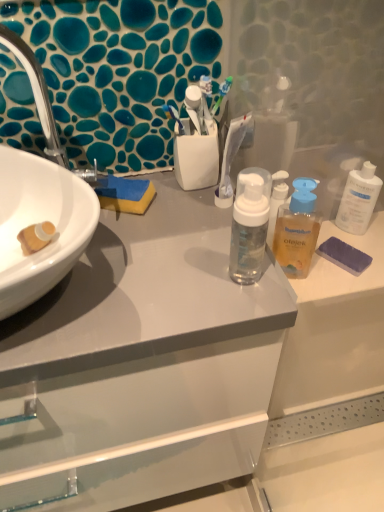
Question: Is purple sponge at right not within white glossy cabinet at center?

Choices:
 (A) no
 (B) yes

Answer: (B)

Question: Is purple sponge at right far from white glossy cabinet at center?

Choices:
 (A) yes
 (B) no

Answer: (B)

Question: From a real-world perspective, does purple sponge at right stand above white glossy cabinet at center?

Choices:
 (A) yes
 (B) no

Answer: (A)

Question: Can you confirm if purple sponge at right is thinner than white glossy cabinet at center?

Choices:
 (A) no
 (B) yes

Answer: (B)

Question: Is purple sponge at right further to the viewer compared to white glossy cabinet at center?

Choices:
 (A) yes
 (B) no

Answer: (A)

Question: Could you tell me if purple sponge at right is turned towards white glossy cabinet at center?

Choices:
 (A) no
 (B) yes

Answer: (A)

Question: Can purple sponge at right be found inside translucent plastic bottle at center?

Choices:
 (A) yes
 (B) no

Answer: (B)

Question: Is translucent plastic bottle at center positioned far away from purple sponge at right?

Choices:
 (A) yes
 (B) no

Answer: (B)

Question: Considering the relative sizes of translucent plastic bottle at center and purple sponge at right in the image provided, is translucent plastic bottle at center shorter than purple sponge at right?

Choices:
 (A) no
 (B) yes

Answer: (A)

Question: Is translucent plastic bottle at center touching purple sponge at right?

Choices:
 (A) no
 (B) yes

Answer: (B)

Question: Is translucent plastic bottle at center closer to camera compared to purple sponge at right?

Choices:
 (A) no
 (B) yes

Answer: (B)

Question: Considering the relative sizes of translucent plastic bottle at center and purple sponge at right in the image provided, is translucent plastic bottle at center taller than purple sponge at right?

Choices:
 (A) yes
 (B) no

Answer: (A)

Question: Is white glossy cabinet at center wider than translucent plastic bottle at center?

Choices:
 (A) yes
 (B) no

Answer: (A)